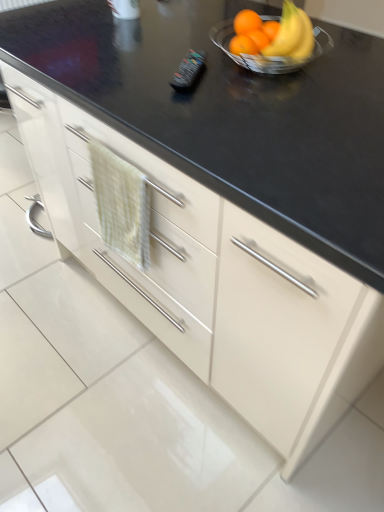
I want to click on free space in front of black plastic remote control at center, so click(x=195, y=101).